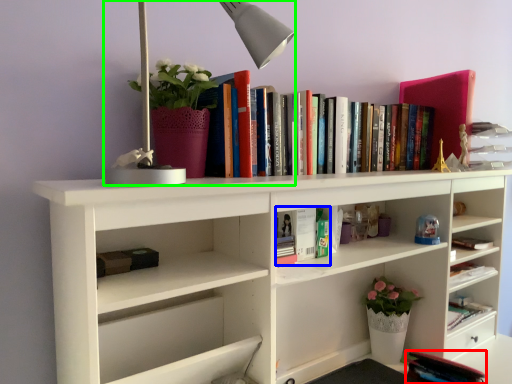
Question: Based on their relative distances, which object is farther from book (highlighted by a red box)? Choose from book (highlighted by a blue box) and table lamp (highlighted by a green box).

Choices:
 (A) book
 (B) table lamp

Answer: (B)